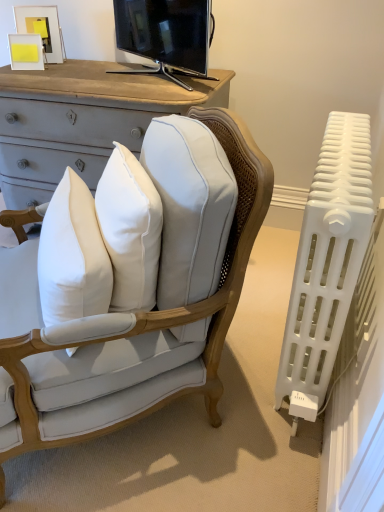
Measure the distance between point (94, 423) and camera.

The depth of point (94, 423) is 1.18 meters.

What do you see at coordinates (26, 52) in the screenshot? I see `matte yellow paper at upper left, the first picture frame when ordered from bottom to top` at bounding box center [26, 52].

What is the approximate height of black glossy tv at upper center?

It is 35.26 centimeters.

I want to click on matte white picture frame at upper left, the second picture frame positioned from the bottom, so click(x=42, y=29).

The image size is (384, 512). Find the location of `white fabric chair at center`. white fabric chair at center is located at coordinates (146, 325).

Considering the relative sizes of white fabric chair at center and white cotton pillow at center in the image provided, is white fabric chair at center bigger than white cotton pillow at center?

Correct, white fabric chair at center is larger in size than white cotton pillow at center.

From the picture: From the image's perspective, is white fabric chair at center on top of white cotton pillow at center?

No.

Who is shorter, white fabric chair at center or white cotton pillow at center?

white cotton pillow at center.

Considering the relative positions of white fabric chair at center and white cotton pillow at center in the image provided, is white fabric chair at center to the left of white cotton pillow at center from the viewer's perspective?

Incorrect, white fabric chair at center is not on the left side of white cotton pillow at center.

Who is shorter, matte white picture frame at upper left, the 1th picture frame positioned from the top, or black glossy tv at upper center?

matte white picture frame at upper left, the 1th picture frame positioned from the top.

Is matte white picture frame at upper left, the second picture frame positioned from the bottom, not close to black glossy tv at upper center?

That's not correct — matte white picture frame at upper left, the second picture frame positioned from the bottom, is a little close to black glossy tv at upper center.

Which is more to the left, matte white picture frame at upper left, the 1th picture frame positioned from the top, or black glossy tv at upper center?

From the viewer's perspective, matte white picture frame at upper left, the 1th picture frame positioned from the top, appears more on the left side.

Based on the photo, which object is thinner, matte white picture frame at upper left, the 1th picture frame positioned from the top, or black glossy tv at upper center?

matte white picture frame at upper left, the 1th picture frame positioned from the top.

Can you tell me how much matte yellow paper at upper left, the first picture frame when ordered from bottom to top, and matte white picture frame at upper left, the second picture frame positioned from the bottom, differ in facing direction?

matte yellow paper at upper left, the first picture frame when ordered from bottom to top, and matte white picture frame at upper left, the second picture frame positioned from the bottom, are facing 5.78 degrees away from each other.

From the image's perspective, which object appears higher, matte yellow paper at upper left, which is counted as the second picture frame, starting from the top, or matte white picture frame at upper left, the second picture frame positioned from the bottom?

matte white picture frame at upper left, the second picture frame positioned from the bottom, is shown above in the image.

From the picture: In terms of width, does matte yellow paper at upper left, which is counted as the second picture frame, starting from the top, look wider or thinner when compared to matte white picture frame at upper left, the second picture frame positioned from the bottom?

Considering their sizes, matte yellow paper at upper left, which is counted as the second picture frame, starting from the top, looks slimmer than matte white picture frame at upper left, the second picture frame positioned from the bottom.

Is matte yellow paper at upper left, the first picture frame when ordered from bottom to top, far from matte white picture frame at upper left, the second picture frame positioned from the bottom?

matte yellow paper at upper left, the first picture frame when ordered from bottom to top, is actually quite close to matte white picture frame at upper left, the second picture frame positioned from the bottom.

In terms of width, does matte white picture frame at upper left, the second picture frame positioned from the bottom, look wider or thinner when compared to white fabric chair at center?

matte white picture frame at upper left, the second picture frame positioned from the bottom, is thinner than white fabric chair at center.

Are matte white picture frame at upper left, the 1th picture frame positioned from the top, and white fabric chair at center making contact?

No, matte white picture frame at upper left, the 1th picture frame positioned from the top, is not with white fabric chair at center.

Can you confirm if matte white picture frame at upper left, the second picture frame positioned from the bottom, is shorter than white fabric chair at center?

Indeed, matte white picture frame at upper left, the second picture frame positioned from the bottom, has a lesser height compared to white fabric chair at center.

What's the angular difference between white cotton pillow at center and white plastic radiator at right's facing directions?

31.1 degrees separate the facing orientations of white cotton pillow at center and white plastic radiator at right.

Is there a large distance between white cotton pillow at center and white plastic radiator at right?

white cotton pillow at center is near white plastic radiator at right, not far away.

Does white cotton pillow at center have a greater height compared to white plastic radiator at right?

Incorrect, the height of white cotton pillow at center is not larger of that of white plastic radiator at right.

Is white cotton pillow at center bigger or smaller than white plastic radiator at right?

In the image, white cotton pillow at center appears to be smaller than white plastic radiator at right.

Relative to matte white picture frame at upper left, the 1th picture frame positioned from the top, is black glossy tv at upper center in front or behind?

Visually, black glossy tv at upper center is located in front of matte white picture frame at upper left, the 1th picture frame positioned from the top.

Considering the positions of objects black glossy tv at upper center and matte white picture frame at upper left, the 1th picture frame positioned from the top, in the image provided, who is more to the left, black glossy tv at upper center or matte white picture frame at upper left, the 1th picture frame positioned from the top,?

Positioned to the left is matte white picture frame at upper left, the 1th picture frame positioned from the top.

How different are the orientations of black glossy tv at upper center and matte white picture frame at upper left, the 1th picture frame positioned from the top, in degrees?

They differ by 55.9 degrees in their facing directions.

Considering the relative sizes of black glossy tv at upper center and matte white picture frame at upper left, the 1th picture frame positioned from the top, in the image provided, is black glossy tv at upper center shorter than matte white picture frame at upper left, the 1th picture frame positioned from the top,?

Incorrect, the height of black glossy tv at upper center does not fall short of that of matte white picture frame at upper left, the 1th picture frame positioned from the top.

Can you confirm if matte white picture frame at upper left, the 1th picture frame positioned from the top, is smaller than white plastic radiator at right?

Correct, matte white picture frame at upper left, the 1th picture frame positioned from the top, occupies less space than white plastic radiator at right.

Does matte white picture frame at upper left, the 1th picture frame positioned from the top, lie behind white plastic radiator at right?

Yes, matte white picture frame at upper left, the 1th picture frame positioned from the top, is behind white plastic radiator at right.

Considering the sizes of matte white picture frame at upper left, the 1th picture frame positioned from the top, and white plastic radiator at right in the image, is matte white picture frame at upper left, the 1th picture frame positioned from the top, taller or shorter than white plastic radiator at right?

matte white picture frame at upper left, the 1th picture frame positioned from the top, is shorter than white plastic radiator at right.

At what (x,y) coordinates should I click in order to perform the action: click on chair in front of the white cotton pillow at center. Please return your answer as a coordinate pair (x, y). Looking at the image, I should click on (146, 325).

Where is `the 2nd picture frame behind the black glossy tv at upper center`? The width and height of the screenshot is (384, 512). the 2nd picture frame behind the black glossy tv at upper center is located at coordinates (42, 29).

From the image, which object appears to be farther from matte yellow paper at upper left, the first picture frame when ordered from bottom to top, white cotton pillow at center or white fabric chair at center?

white fabric chair at center.

Based on their spatial positions, is black glossy tv at upper center or white plastic radiator at right closer to white cotton pillow at center?

Among the two, white plastic radiator at right is located nearer to white cotton pillow at center.

Which object lies further to the anchor point white plastic radiator at right, matte white picture frame at upper left, the second picture frame positioned from the bottom, or white cotton pillow at center?

The object further to white plastic radiator at right is matte white picture frame at upper left, the second picture frame positioned from the bottom.

Based on their spatial positions, is white fabric chair at center or white cotton pillow at center further from black glossy tv at upper center?

white fabric chair at center is positioned further to the anchor black glossy tv at upper center.

Based on their spatial positions, is white plastic radiator at right or white fabric chair at center closer to matte white picture frame at upper left, the 1th picture frame positioned from the top?

The object closer to matte white picture frame at upper left, the 1th picture frame positioned from the top, is white fabric chair at center.

Looking at the image, which one is located further to white cotton pillow at center, white plastic radiator at right or matte white picture frame at upper left, the 1th picture frame positioned from the top?

Based on the image, matte white picture frame at upper left, the 1th picture frame positioned from the top, appears to be further to white cotton pillow at center.

Estimate the real-world distances between objects in this image. Which object is closer to black glossy tv at upper center, white fabric chair at center or matte yellow paper at upper left, the first picture frame when ordered from bottom to top?

matte yellow paper at upper left, the first picture frame when ordered from bottom to top, is closer to black glossy tv at upper center.

Looking at the image, which one is located further to black glossy tv at upper center, white cotton pillow at center or white plastic radiator at right?

white cotton pillow at center lies further to black glossy tv at upper center than the other object.

Locate an element on the screen. radiator positioned between white fabric chair at center and matte yellow paper at upper left, the first picture frame when ordered from bottom to top, from near to far is located at coordinates (326, 264).

At what (x,y) coordinates should I click in order to perform the action: click on television between matte white picture frame at upper left, the second picture frame positioned from the bottom, and white cotton pillow at center, in the vertical direction. Please return your answer as a coordinate pair (x, y). The height and width of the screenshot is (512, 384). Looking at the image, I should click on tap(166, 35).

Where is `television between white fabric chair at center and matte white picture frame at upper left, the second picture frame positioned from the bottom, from front to back`? Image resolution: width=384 pixels, height=512 pixels. television between white fabric chair at center and matte white picture frame at upper left, the second picture frame positioned from the bottom, from front to back is located at coordinates (166, 35).

This screenshot has height=512, width=384. Find the location of `pillow between white fabric chair at center and matte yellow paper at upper left, which is counted as the second picture frame, starting from the top, along the z-axis`. pillow between white fabric chair at center and matte yellow paper at upper left, which is counted as the second picture frame, starting from the top, along the z-axis is located at coordinates (72, 256).